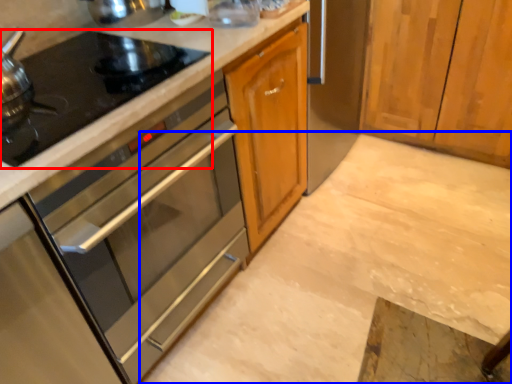
Question: Which object is closer to the camera taking this photo, gas stove (highlighted by a red box) or concrete (highlighted by a blue box)?

Choices:
 (A) gas stove
 (B) concrete

Answer: (A)